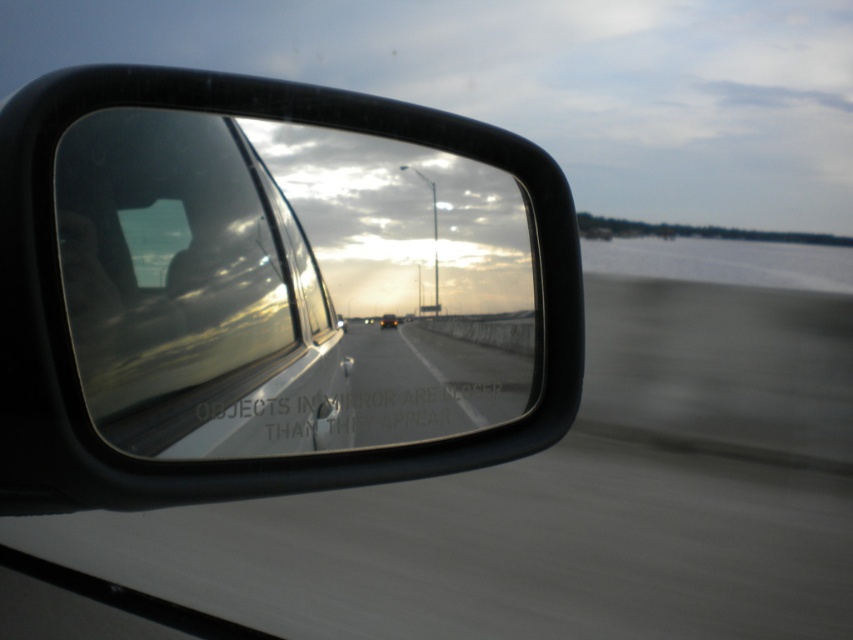
Question: Is black plastic rearview mirror at upper left to the right of matte black car at center from the viewer's perspective?

Choices:
 (A) no
 (B) yes

Answer: (B)

Question: Considering the relative positions of transparent glass car window at center and matte black car at center in the image provided, where is transparent glass car window at center located with respect to matte black car at center?

Choices:
 (A) above
 (B) below

Answer: (A)

Question: Considering the real-world distances, which object is farthest from the transparent glass car window at center?

Choices:
 (A) black plastic rearview mirror at upper left
 (B) matte black car at center

Answer: (B)

Question: Which is nearer to the black plastic rearview mirror at upper left?

Choices:
 (A) transparent glass car window at center
 (B) matte black car at center

Answer: (A)

Question: In this image, where is black plastic rearview mirror at upper left located relative to matte black car at center?

Choices:
 (A) right
 (B) left

Answer: (A)

Question: Which point is closer to the camera?

Choices:
 (A) click(x=392, y=316)
 (B) click(x=61, y=320)

Answer: (B)